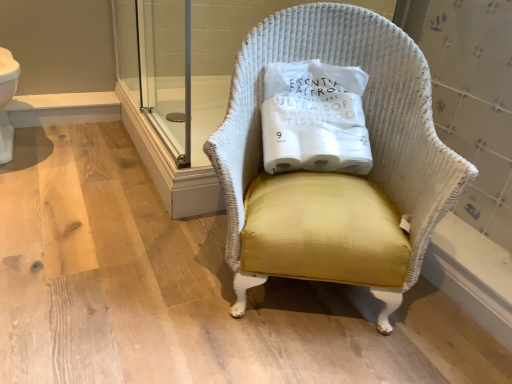
Locate an element on the screen. Image resolution: width=512 pixels, height=384 pixels. white wicker chair at center is located at coordinates (338, 175).

What do you see at coordinates (338, 175) in the screenshot?
I see `white wicker chair at center` at bounding box center [338, 175].

Locate an element on the screen. The image size is (512, 384). yellow fabric pillow at center is located at coordinates (314, 118).

This screenshot has height=384, width=512. What do you see at coordinates (314, 118) in the screenshot?
I see `yellow fabric pillow at center` at bounding box center [314, 118].

The width and height of the screenshot is (512, 384). I want to click on white wicker chair at center, so pyautogui.click(x=338, y=175).

Does yellow fabric pillow at center appear on the right side of white wicker chair at center?

No.

Considering their positions, is yellow fabric pillow at center located in front of or behind white wicker chair at center?

In the image, yellow fabric pillow at center appears behind white wicker chair at center.

Does point (281, 63) come behind point (290, 44)?

No, (281, 63) is in front of (290, 44).

From the image's perspective, which one is positioned lower, yellow fabric pillow at center or white wicker chair at center?

white wicker chair at center appears lower in the image.

From a real-world perspective, is yellow fabric pillow at center physically located above or below white wicker chair at center?

yellow fabric pillow at center is situated higher than white wicker chair at center in the real world.

Between yellow fabric pillow at center and white wicker chair at center, which one has smaller width?

Thinner between the two is yellow fabric pillow at center.

Considering the relative sizes of yellow fabric pillow at center and white wicker chair at center in the image provided, is yellow fabric pillow at center shorter than white wicker chair at center?

Indeed, yellow fabric pillow at center has a lesser height compared to white wicker chair at center.

Is yellow fabric pillow at center smaller than white wicker chair at center?

Yes, yellow fabric pillow at center is smaller than white wicker chair at center.

Does yellow fabric pillow at center contain white wicker chair at center?

Definitely not — white wicker chair at center is not inside yellow fabric pillow at center.

Does yellow fabric pillow at center touch white wicker chair at center?

No, yellow fabric pillow at center is not with white wicker chair at center.

Is yellow fabric pillow at center facing away from white wicker chair at center?

Yes, white wicker chair at center is at the back of yellow fabric pillow at center.

How many degrees apart are the facing directions of yellow fabric pillow at center and white wicker chair at center?

11.4 degrees.

How distant is yellow fabric pillow at center from white wicker chair at center?

yellow fabric pillow at center and white wicker chair at center are 5.14 inches apart from each other.

Locate an element on the screen. chair that appears in front of the yellow fabric pillow at center is located at coordinates (338, 175).

Would you say white wicker chair at center is to the left or to the right of yellow fabric pillow at center in the picture?

In the image, white wicker chair at center appears on the right side of yellow fabric pillow at center.

Is the depth of white wicker chair at center less than that of yellow fabric pillow at center?

Yes, the depth of white wicker chair at center is less than that of yellow fabric pillow at center.

Is point (335, 196) farther from camera compared to point (339, 168)?

No, (335, 196) is in front of (339, 168).

From the image's perspective, who appears lower, white wicker chair at center or yellow fabric pillow at center?

white wicker chair at center.

From a real-world perspective, is white wicker chair at center below yellow fabric pillow at center?

Yes, from a real-world perspective, white wicker chair at center is under yellow fabric pillow at center.

Which of these two, white wicker chair at center or yellow fabric pillow at center, is wider?

Wider between the two is white wicker chair at center.

Considering the relative sizes of white wicker chair at center and yellow fabric pillow at center in the image provided, is white wicker chair at center taller than yellow fabric pillow at center?

Yes, white wicker chair at center is taller than yellow fabric pillow at center.

Considering the relative sizes of white wicker chair at center and yellow fabric pillow at center in the image provided, is white wicker chair at center bigger than yellow fabric pillow at center?

Yes, white wicker chair at center is bigger than yellow fabric pillow at center.

Is white wicker chair at center outside of yellow fabric pillow at center?

Yes, white wicker chair at center is located beyond the bounds of yellow fabric pillow at center.

Is white wicker chair at center not near yellow fabric pillow at center?

No, white wicker chair at center is not far from yellow fabric pillow at center.

Could you tell me if white wicker chair at center is turned towards yellow fabric pillow at center?

Yes, white wicker chair at center is oriented towards yellow fabric pillow at center.

How many degrees apart are the facing directions of white wicker chair at center and yellow fabric pillow at center?

The facing directions of white wicker chair at center and yellow fabric pillow at center are 11.4 degrees apart.

Where is `pillow that appears behind the white wicker chair at center`? The image size is (512, 384). pillow that appears behind the white wicker chair at center is located at coordinates (314, 118).

Find the location of a particular element. pillow lying behind the white wicker chair at center is located at coordinates (314, 118).

This screenshot has width=512, height=384. I want to click on chair in front of the yellow fabric pillow at center, so click(x=338, y=175).